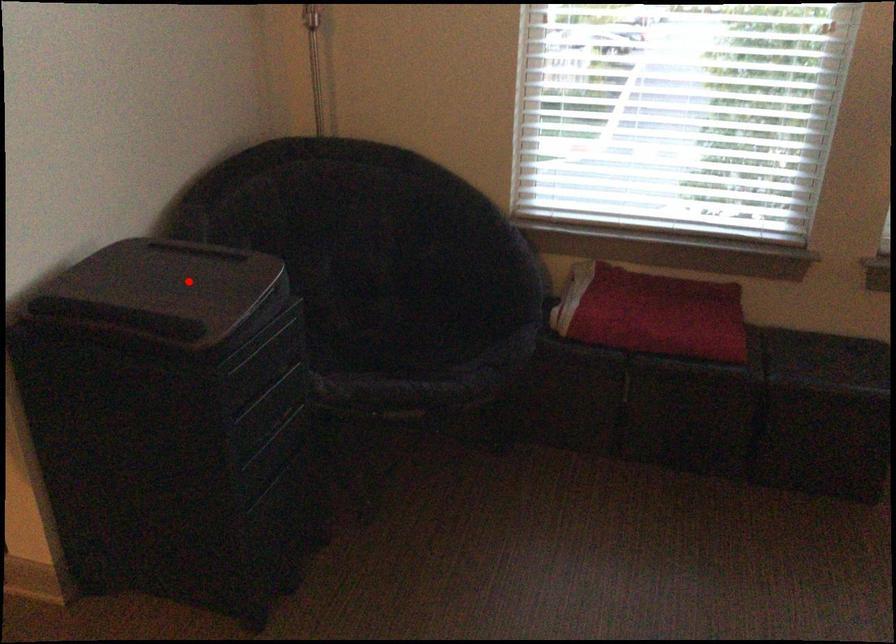
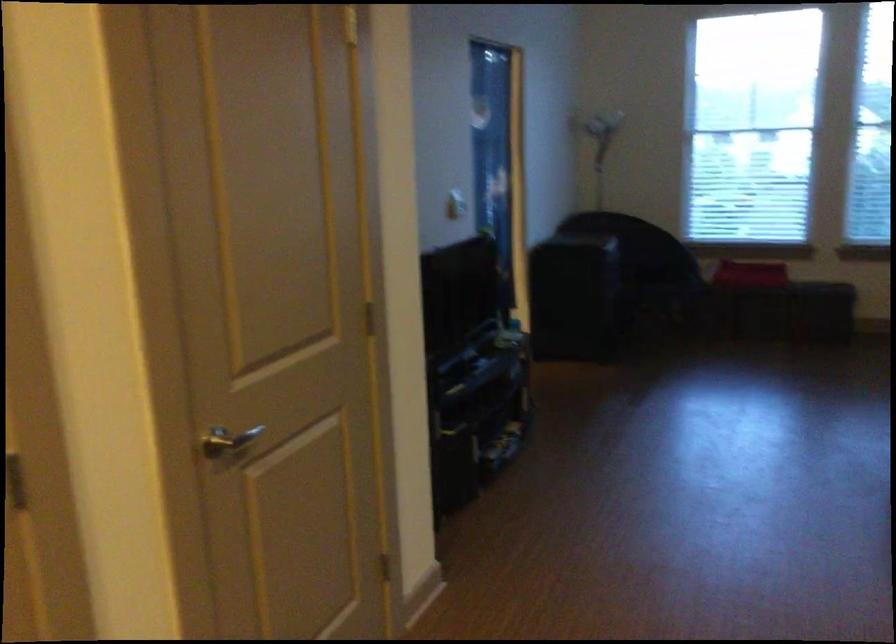
Question: I am providing you with two images of the same scene from different viewpoints. A red point is marked on the first image. Is the red point's position out of view in image 2?

Choices:
 (A) Yes
 (B) No

Answer: (A)